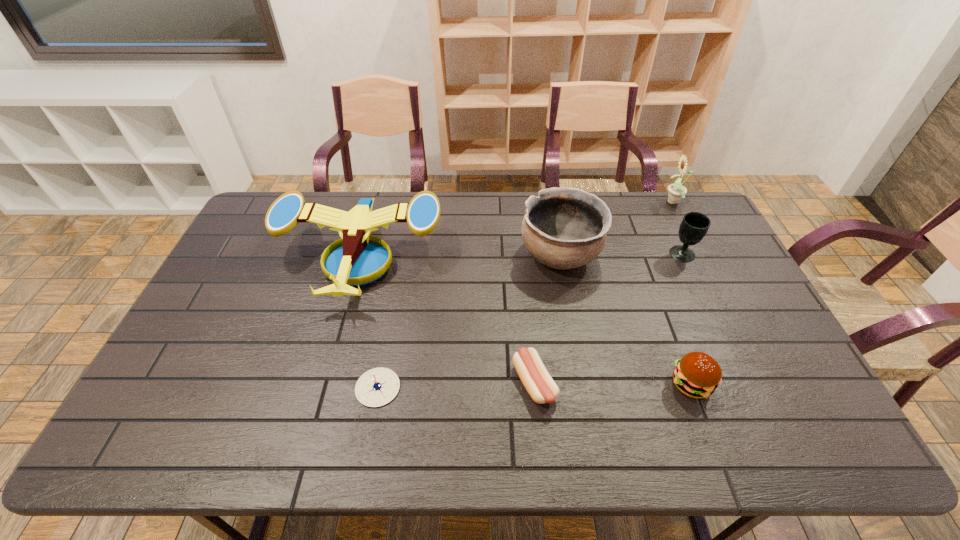
The height and width of the screenshot is (540, 960). I want to click on sunflower, so click(x=676, y=191).

At what (x,y) coordinates should I click in order to perform the action: click on pottery. Please return your answer as a coordinate pair (x, y). Looking at the image, I should click on (563, 228).

Where is `drone`? This screenshot has width=960, height=540. drone is located at coordinates (357, 260).

You are a GUI agent. You are given a task and a screenshot of the screen. Output one action in this format:
    pyautogui.click(x=<x>, y=<y>)
    Task: Click on the chalice
    
    Given the screenshot: What is the action you would take?
    pyautogui.click(x=694, y=226)

Where is `hamburger`? hamburger is located at coordinates (697, 375).

What are the coordinates of `the third object from right to left` in the screenshot? It's located at (697, 375).

The image size is (960, 540). I want to click on compass, so 377,387.

Identify the location of sausage. The width and height of the screenshot is (960, 540). (539, 384).

I want to click on vacant space located on the front-facing side of the farthest object, so click(622, 203).

This screenshot has height=540, width=960. Identify the location of vacant area situated on the front-facing side of the farthest object. (x=604, y=203).